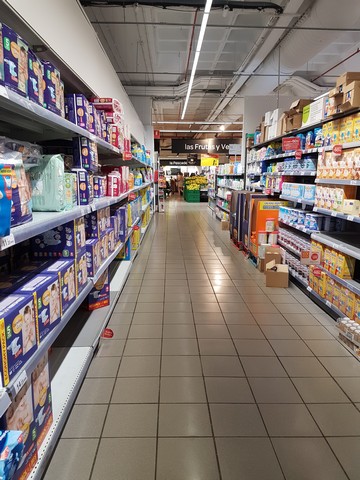
I want to click on 4 rows of shelves on left side, so click(x=42, y=394), click(x=24, y=321), click(x=35, y=192), click(x=30, y=68).